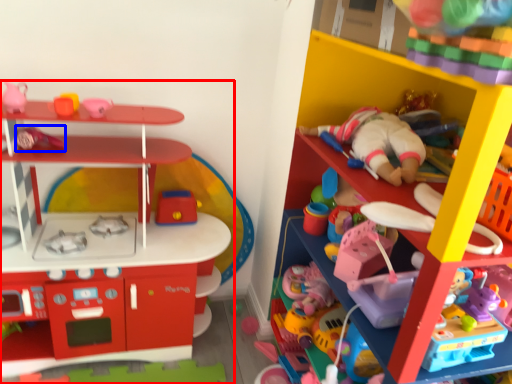
Question: Which object appears farthest to the camera in this image, toy (highlighted by a red box) or toy (highlighted by a blue box)?

Choices:
 (A) toy
 (B) toy

Answer: (B)